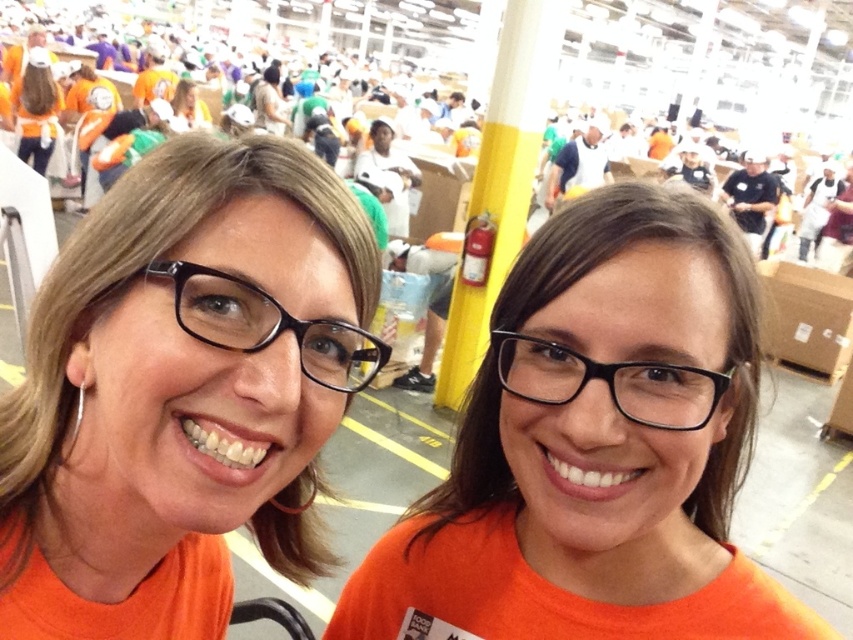
Question: Among these points, which one is nearest to the camera?

Choices:
 (A) (614, 362)
 (B) (183, 317)
 (C) (51, 96)

Answer: (B)

Question: Which of the following is the farthest from the observer?

Choices:
 (A) matte orange shirt at upper left
 (B) black plastic glasses at left

Answer: (A)

Question: Is orange matte/softobject at left bigger than black plastic glasses at left?

Choices:
 (A) yes
 (B) no

Answer: (A)

Question: Is orange matte shirt at center to the right of matte orange shirt at upper left from the viewer's perspective?

Choices:
 (A) yes
 (B) no

Answer: (A)

Question: Is orange matte shirt at center bigger than black plastic glasses at left?

Choices:
 (A) yes
 (B) no

Answer: (A)

Question: Which object is positioned farthest from the orange matte/softobject at left?

Choices:
 (A) black plastic glasses at left
 (B) orange matte shirt at center
 (C) black plastic glasses at center
 (D) matte orange shirt at upper left

Answer: (D)